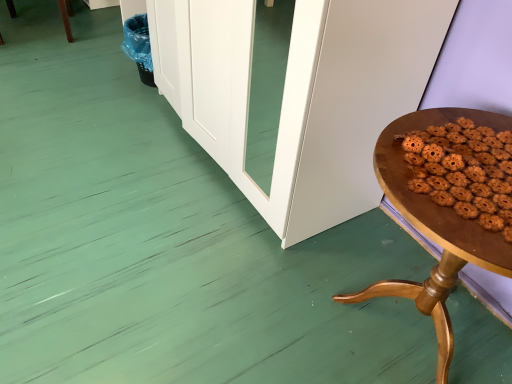
Where is `wooden table at right`? This screenshot has height=384, width=512. wooden table at right is located at coordinates (434, 228).

What do you see at coordinates (434, 228) in the screenshot? I see `wooden table at right` at bounding box center [434, 228].

Image resolution: width=512 pixels, height=384 pixels. What do you see at coordinates (464, 171) in the screenshot?
I see `brown matte cookies at right` at bounding box center [464, 171].

Measure the distance between point (459, 201) and camera.

A distance of 33.78 inches exists between point (459, 201) and camera.

Find the location of a particular element. Image resolution: width=512 pixels, height=384 pixels. brown matte cookies at right is located at coordinates (464, 171).

Where is `wooden table at right`? The height and width of the screenshot is (384, 512). wooden table at right is located at coordinates (434, 228).

Which object is positioned more to the right, wooden table at right or brown matte cookies at right?

From the viewer's perspective, wooden table at right appears more on the right side.

Is the position of wooden table at right more distant than that of brown matte cookies at right?

No, wooden table at right is closer to the viewer.

Does point (434, 268) come in front of point (413, 170)?

No, it is behind (413, 170).

Based on the photo, from the image's perspective, which is above, wooden table at right or brown matte cookies at right?

brown matte cookies at right appears higher in the image.

From a real-world perspective, is wooden table at right physically above brown matte cookies at right?

Actually, wooden table at right is physically below brown matte cookies at right in the real world.

Considering the sizes of wooden table at right and brown matte cookies at right in the image, is wooden table at right wider or thinner than brown matte cookies at right?

wooden table at right is wider than brown matte cookies at right.

Is wooden table at right taller than brown matte cookies at right?

Correct, wooden table at right is much taller as brown matte cookies at right.

Considering the sizes of wooden table at right and brown matte cookies at right in the image, is wooden table at right bigger or smaller than brown matte cookies at right?

Clearly, wooden table at right is larger in size than brown matte cookies at right.

Could brown matte cookies at right be considered to be inside wooden table at right?

That's correct, brown matte cookies at right is inside wooden table at right.

Consider the image. Is wooden table at right directly adjacent to brown matte cookies at right?

Yes, wooden table at right is right next to brown matte cookies at right and making contact.

Could you tell me if wooden table at right is facing brown matte cookies at right?

No, wooden table at right is not facing towards brown matte cookies at right.

How different are the orientations of wooden table at right and brown matte cookies at right in degrees?

0.000102 degrees.

The width and height of the screenshot is (512, 384). What are the coordinates of `food above the wooden table at right (from a real-world perspective)` in the screenshot? It's located at (464, 171).

Considering the positions of objects brown matte cookies at right and wooden table at right in the image provided, who is more to the left, brown matte cookies at right or wooden table at right?

brown matte cookies at right.

Is brown matte cookies at right positioned in front of wooden table at right?

No, brown matte cookies at right is further to the viewer.

Is point (412, 142) positioned behind point (424, 210)?

That is True.

From the image's perspective, between brown matte cookies at right and wooden table at right, which one is located above?

brown matte cookies at right is shown above in the image.

From a real-world perspective, which object stands above the other?

brown matte cookies at right, from a real-world perspective.

Considering the sizes of objects brown matte cookies at right and wooden table at right in the image provided, who is wider, brown matte cookies at right or wooden table at right?

wooden table at right.

Between brown matte cookies at right and wooden table at right, which one has less height?

brown matte cookies at right is shorter.

Considering the sizes of objects brown matte cookies at right and wooden table at right in the image provided, who is smaller, brown matte cookies at right or wooden table at right?

Smaller between the two is brown matte cookies at right.

Can wooden table at right be found inside brown matte cookies at right?

No, wooden table at right is located outside of brown matte cookies at right.

Is brown matte cookies at right far away from wooden table at right?

They are positioned close to each other.

Is brown matte cookies at right facing towards wooden table at right?

No, brown matte cookies at right is not turned towards wooden table at right.

How different are the orientations of brown matte cookies at right and wooden table at right in degrees?

brown matte cookies at right and wooden table at right are facing 0.000102 degrees away from each other.

Measure the distance from brown matte cookies at right to wooden table at right.

brown matte cookies at right and wooden table at right are 7.37 centimeters apart.

Locate an element on the screen. food that is on the left side of wooden table at right is located at coordinates (464, 171).

Find the location of a particular element. The width and height of the screenshot is (512, 384). table that is under the brown matte cookies at right (from a real-world perspective) is located at coordinates (434, 228).

Identify the location of table below the brown matte cookies at right (from the image's perspective). (434, 228).